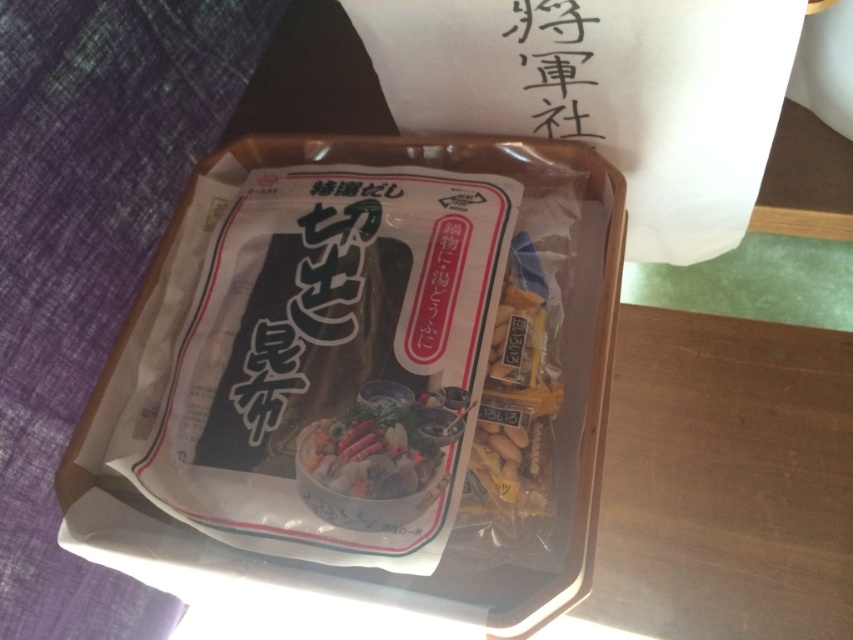
You are a food delivery person who needs to pack these items into a box. The box can only accommodate items up to the width of the shiny plastic food at center. Can the transparent plastic bag of seaweed at center fit into the box?

The transparent plastic bag of seaweed at center is wider than the shiny plastic food at center, so it cannot fit into the box designed for items up to the width of the shiny plastic food at center.

In the scene shown: You are a food inspector standing 30 inches away from the wooden table. You need to check the transparent plastic bag of seaweed at center. Can you reach it without moving your position?

The transparent plastic bag of seaweed at center is 27.81 inches away from the camera. Since you are standing 30 inches away from the wooden table, you can reach it without moving your position because the distance between you and the bag is within your reach.